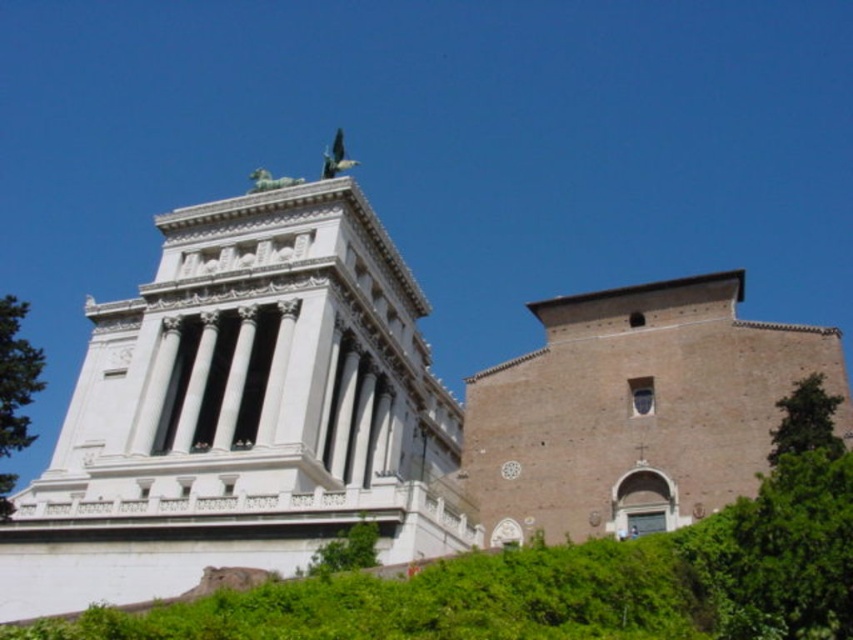
Question: Estimate the real-world distances between objects in this image. Which object is closer to the white marble tower at upper left?

Choices:
 (A) green leafy tree at lower center
 (B) green leafy tree at left
 (C) green leafy tree at right

Answer: (B)

Question: Which object is the closest to the green leafy tree at lower center?

Choices:
 (A) green leafy tree at left
 (B) green leafy tree at right
 (C) white marble tower at upper left

Answer: (C)

Question: Can you confirm if green leafy tree at left is wider than green leafy tree at lower center?

Choices:
 (A) yes
 (B) no

Answer: (A)

Question: Does white marble tower at upper left have a lesser width compared to green leafy tree at left?

Choices:
 (A) no
 (B) yes

Answer: (B)

Question: Based on their relative distances, which object is nearer to the green leafy tree at lower center?

Choices:
 (A) green leafy tree at left
 (B) green leafy tree at right
 (C) white marble tower at upper left

Answer: (C)

Question: Observing the image, what is the correct spatial positioning of white marble tower at upper left in reference to green leafy tree at left?

Choices:
 (A) right
 (B) left

Answer: (A)